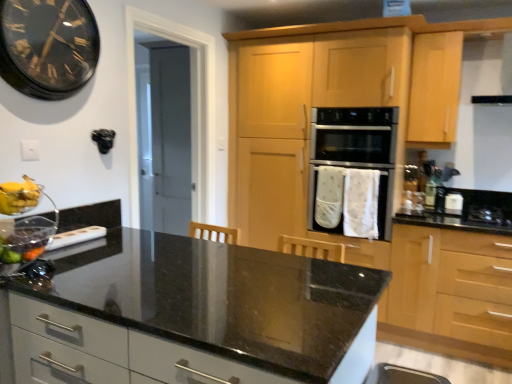
How much space does light wood/texture cabinet at right, the 2th cabinetry in the left-to-right sequence, occupy vertically?

It is 1.07 meters.

What do you see at coordinates (450, 294) in the screenshot? I see `light wood/texture cabinet at right, arranged as the 1th cabinetry when viewed from the right` at bounding box center [450, 294].

What is the approximate height of black matte exhaust hood at upper right?

black matte exhaust hood at upper right is 18.14 inches tall.

What do you see at coordinates (487, 70) in the screenshot?
I see `black matte exhaust hood at upper right` at bounding box center [487, 70].

Locate an element on the screen. The width and height of the screenshot is (512, 384). black glass gas stove at right is located at coordinates (488, 214).

The width and height of the screenshot is (512, 384). In order to click on white fabric oven at center in this screenshot , I will do `click(353, 170)`.

Is transparent glass bowl at lower left to the left or to the right of black granite countertop at center in the image?

transparent glass bowl at lower left is to the left of black granite countertop at center.

From a real-world perspective, which is physically below, transparent glass bowl at lower left or black granite countertop at center?

In real-world perspective, black granite countertop at center is lower.

Identify the location of countertop located in front of the transparent glass bowl at lower left. (197, 317).

Between transparent glass bowl at lower left and black granite countertop at center, which one has more height?

Standing taller between the two is black granite countertop at center.

From the image's perspective, which one is positioned lower, black matte exhaust hood at upper right or light wood cabinetry at center, the 1th cabinetry when ordered from left to right?

light wood cabinetry at center, the 1th cabinetry when ordered from left to right, is shown below in the image.

Is black matte exhaust hood at upper right beside light wood cabinetry at center, the 2th cabinetry from the right?

There is a gap between black matte exhaust hood at upper right and light wood cabinetry at center, the 2th cabinetry from the right.

Is black matte exhaust hood at upper right inside the boundaries of light wood cabinetry at center, the 1th cabinetry when ordered from left to right, or outside?

black matte exhaust hood at upper right is not inside light wood cabinetry at center, the 1th cabinetry when ordered from left to right, it's outside.

Looking at the image, does black matte exhaust hood at upper right seem bigger or smaller compared to light wood cabinetry at center, the 1th cabinetry when ordered from left to right?

Considering their sizes, black matte exhaust hood at upper right takes up less space than light wood cabinetry at center, the 1th cabinetry when ordered from left to right.

Consider the image. From the image's perspective, which object appears higher, transparent glass bowl at lower left or black glass gas stove at right?

transparent glass bowl at lower left is shown above in the image.

Consider the image. From a real-world perspective, is transparent glass bowl at lower left positioned above or below black glass gas stove at right?

transparent glass bowl at lower left is situated higher than black glass gas stove at right in the real world.

Considering the positions of objects transparent glass bowl at lower left and black glass gas stove at right in the image provided, who is more to the right, transparent glass bowl at lower left or black glass gas stove at right?

From the viewer's perspective, black glass gas stove at right appears more on the right side.

Locate an element on the screen. gas stove behind the transparent glass bowl at lower left is located at coordinates (488, 214).

Which object is closer to the camera taking this photo, black glass clock at upper left or shiny plastic grapes at left?

shiny plastic grapes at left is closer to the camera.

Would you consider black glass clock at upper left to be distant from shiny plastic grapes at left?

black glass clock at upper left is near shiny plastic grapes at left, not far away.

Would you say black glass clock at upper left is outside shiny plastic grapes at left?

That's correct, black glass clock at upper left is outside of shiny plastic grapes at left.

Looking at their sizes, would you say yellow matte banana at left is wider or thinner than black glass gas stove at right?

yellow matte banana at left is thinner than black glass gas stove at right.

Is yellow matte banana at left in front of or behind black glass gas stove at right in the image?

yellow matte banana at left is positioned closer to the viewer than black glass gas stove at right.

Is black glass gas stove at right located within yellow matte banana at left?

No, yellow matte banana at left does not contain black glass gas stove at right.

Is yellow matte banana at left beside black glass gas stove at right?

yellow matte banana at left and black glass gas stove at right are clearly separated.

In the image, is transparent glass bowl at lower left positioned in front of or behind black matte exhaust hood at upper right?

transparent glass bowl at lower left is in front of black matte exhaust hood at upper right.

From the image's perspective, between transparent glass bowl at lower left and black matte exhaust hood at upper right, who is located below?

transparent glass bowl at lower left.

Looking at this image, which of these two, transparent glass bowl at lower left or black matte exhaust hood at upper right, stands taller?

Standing taller between the two is black matte exhaust hood at upper right.

Consider the image. Looking at their sizes, would you say transparent glass bowl at lower left is wider or thinner than black matte exhaust hood at upper right?

In the image, transparent glass bowl at lower left appears to be more narrow than black matte exhaust hood at upper right.

From a real-world perspective, is black glass gas stove at right on top of yellow matte banana at left?

Actually, black glass gas stove at right is physically below yellow matte banana at left in the real world.

Considering the relative positions of black glass gas stove at right and yellow matte banana at left in the image provided, is black glass gas stove at right to the left of yellow matte banana at left from the viewer's perspective?

No.

I want to click on countertop on the right of the transparent glass bowl at lower left, so click(x=197, y=317).

Where is `exhaust hood located in front of the light wood cabinetry at center, the 2th cabinetry from the right`? The image size is (512, 384). exhaust hood located in front of the light wood cabinetry at center, the 2th cabinetry from the right is located at coordinates (487, 70).

From the image, which object appears to be nearer to yellow matte banana at left, white fabric oven at center or black matte exhaust hood at upper right?

white fabric oven at center lies closer to yellow matte banana at left than the other object.

From the image, which object appears to be farther from white fabric oven at center, black glass gas stove at right or yellow matte banana at left?

yellow matte banana at left is further to white fabric oven at center.

When comparing their distances from white fabric oven at center, does black glass gas stove at right or black glass clock at upper left seem further?

Based on the image, black glass clock at upper left appears to be further to white fabric oven at center.

Considering their positions, is black matte exhaust hood at upper right positioned closer to yellow matte banana at left than light wood cabinetry at center, the 1th cabinetry when ordered from left to right?

The object closer to yellow matte banana at left is light wood cabinetry at center, the 1th cabinetry when ordered from left to right.

Looking at the image, which one is located further to black matte exhaust hood at upper right, white fabric oven at center or black granite countertop at center?

black granite countertop at center is further to black matte exhaust hood at upper right.

Based on their spatial positions, is black granite countertop at center or black matte exhaust hood at upper right closer to transparent glass bowl at lower left?

The object closer to transparent glass bowl at lower left is black granite countertop at center.

Which object lies further to the anchor point black matte exhaust hood at upper right, white fabric oven at center or transparent glass bowl at lower left?

transparent glass bowl at lower left lies further to black matte exhaust hood at upper right than the other object.

From the image, which object appears to be nearer to white fabric oven at center, light wood cabinetry at center, the 1th cabinetry when ordered from left to right, or transparent glass bowl at lower left?

light wood cabinetry at center, the 1th cabinetry when ordered from left to right, lies closer to white fabric oven at center than the other object.

Where is `oven between transparent glass bowl at lower left and black glass gas stove at right from left to right`? oven between transparent glass bowl at lower left and black glass gas stove at right from left to right is located at coordinates (353, 170).

Locate an element on the screen. glass bowl between yellow matte banana at left and black glass gas stove at right in the horizontal direction is located at coordinates (23, 226).

Where is `glass bowl between black glass clock at upper left and black glass gas stove at right from left to right`? glass bowl between black glass clock at upper left and black glass gas stove at right from left to right is located at coordinates (23, 226).

Where is `oven between yellow matte banana at left and light wood/texture cabinet at right, the 2th cabinetry in the left-to-right sequence`? This screenshot has height=384, width=512. oven between yellow matte banana at left and light wood/texture cabinet at right, the 2th cabinetry in the left-to-right sequence is located at coordinates (353, 170).